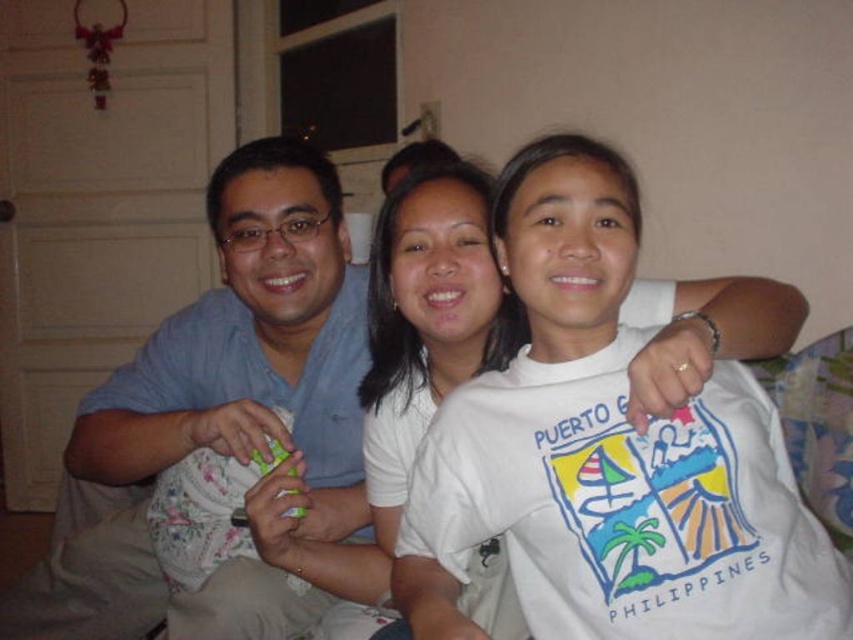
Is light blue cotton shirt at left in front of white cotton shirt at center?

No, it is behind white cotton shirt at center.

Describe the element at coordinates (248, 356) in the screenshot. I see `light blue cotton shirt at left` at that location.

At what (x,y) coordinates should I click in order to perform the action: click on light blue cotton shirt at left. Please return your answer as a coordinate pair (x, y). The height and width of the screenshot is (640, 853). Looking at the image, I should click on (248, 356).